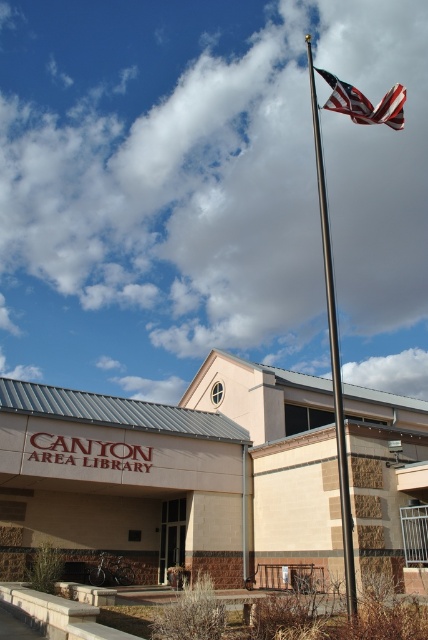
You are standing in front of the Canyon Area Library and want to take a photo of the library sign. The sign is at the top of the building. To avoid the polished metal flag pole at upper center from blocking the view, should you move to your left or right?

The polished metal flag pole at upper center is located at point [333,355], which is to the right of the center. Moving to your left would position you to the left of the flag pole, allowing an unobstructed view of the library sign at the top of the building.

You are standing in front of the Canyon Area Library and notice the polished metal flag pole at upper center and the american flag at upper center. Which object is positioned higher in the image?

The american flag at upper center is positioned higher than the polished metal flag pole at upper center.

You are standing in front of the Canyon Area Library and notice the polished metal flag pole at upper center and the american flag at upper center. Which object is wider?

The polished metal flag pole at upper center has a lesser width compared to the american flag at upper center, so the american flag at upper center is wider.